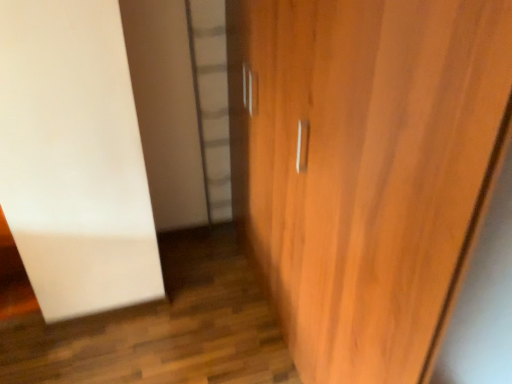
This screenshot has height=384, width=512. What do you see at coordinates (365, 168) in the screenshot? I see `wooden door at center` at bounding box center [365, 168].

The height and width of the screenshot is (384, 512). In order to click on wooden door at center in this screenshot , I will do `click(365, 168)`.

Locate an element on the screen. wooden door at center is located at coordinates (365, 168).